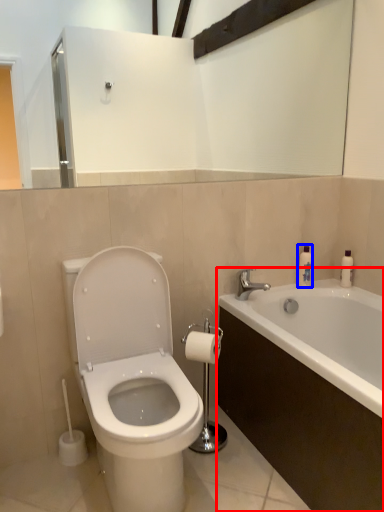
Question: Which of the following is the farthest to the observer, bathtub (highlighted by a red box) or soap dispenser (highlighted by a blue box)?

Choices:
 (A) bathtub
 (B) soap dispenser

Answer: (B)